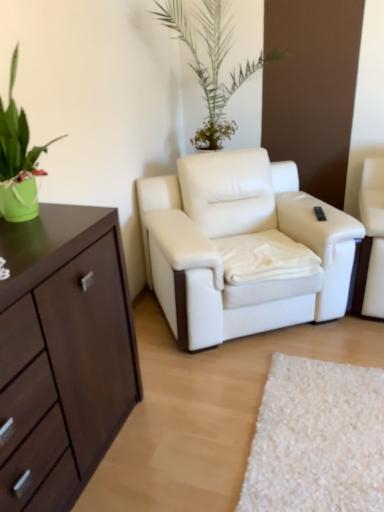
Image resolution: width=384 pixels, height=512 pixels. What are the coordinates of `vacant space in front of white leather armchair at center` in the screenshot? It's located at (261, 413).